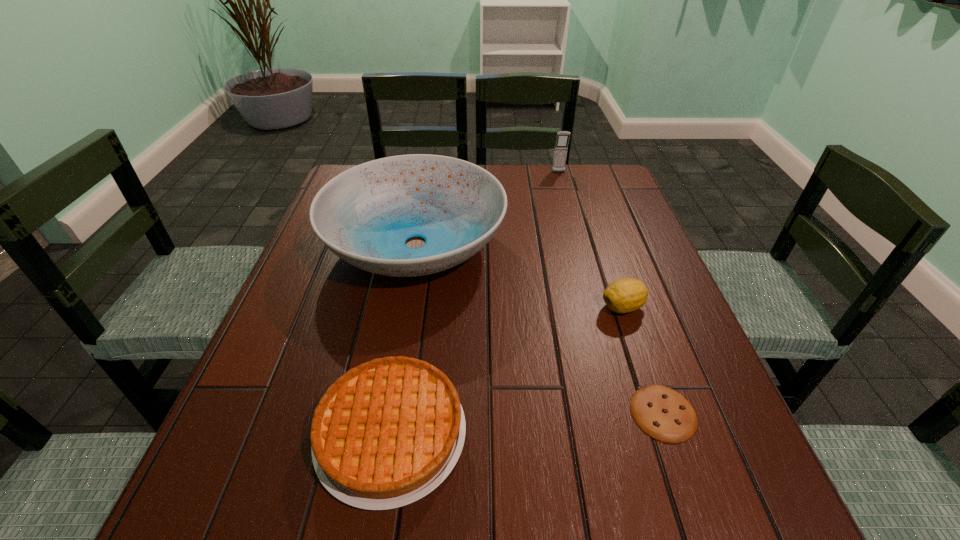
Find the location of a particular element. free space located 0.230m on the right of the pie is located at coordinates (603, 434).

Find the location of a particular element. The image size is (960, 540). free space located on the right of the cookie is located at coordinates (724, 413).

I want to click on cellular telephone situated at the far edge, so pyautogui.click(x=561, y=146).

Locate an element on the screen. dish located at the far edge is located at coordinates (364, 215).

You are a GUI agent. You are given a task and a screenshot of the screen. Output one action in this format:
    pyautogui.click(x=<x>, y=<y>)
    Task: Click on the object that is positioned at the near edge
    This screenshot has width=960, height=540.
    Given the screenshot: What is the action you would take?
    pyautogui.click(x=386, y=433)

You are a GUI agent. You are given a task and a screenshot of the screen. Output one action in this format:
    pyautogui.click(x=<x>, y=<y>)
    Task: Click on the dish that is at the left edge
    The width and height of the screenshot is (960, 540).
    Given the screenshot: What is the action you would take?
    pyautogui.click(x=364, y=215)

This screenshot has height=540, width=960. I want to click on pie located at the left edge, so click(386, 433).

This screenshot has height=540, width=960. Identify the location of cellular telephone that is at the right edge. (561, 146).

You are a GUI agent. You are given a task and a screenshot of the screen. Output one action in this format:
    pyautogui.click(x=<x>, y=<y>)
    Task: Click on the lemon at the right edge
    Image resolution: width=960 pixels, height=540 pixels.
    Given the screenshot: What is the action you would take?
    pyautogui.click(x=624, y=295)

Locate an element on the screen. This screenshot has height=540, width=960. cookie that is at the right edge is located at coordinates (661, 412).